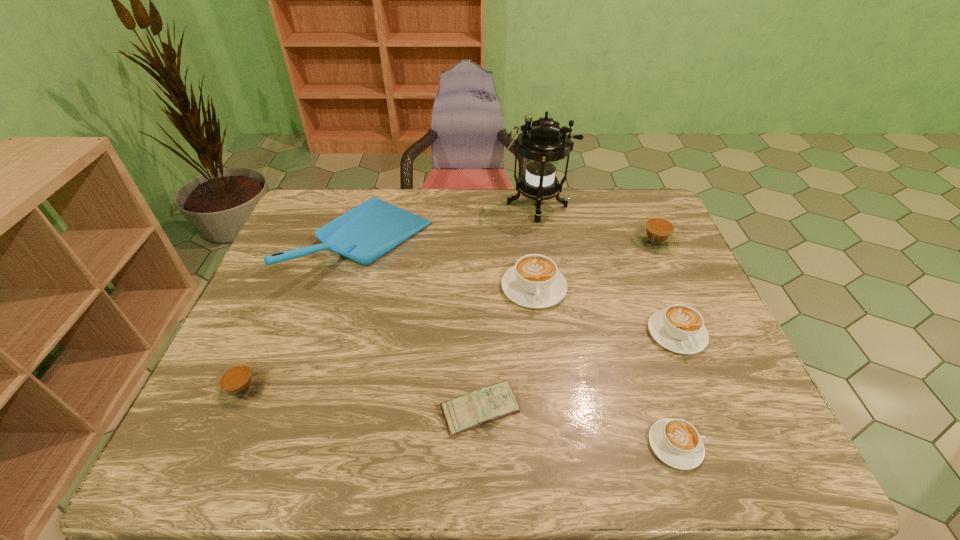
The width and height of the screenshot is (960, 540). Identify the location of object that is at the near right corner. (676, 442).

Where is `vacant space at the far edge of the desktop`? The image size is (960, 540). vacant space at the far edge of the desktop is located at coordinates (500, 217).

This screenshot has height=540, width=960. I want to click on vacant region at the left edge, so click(239, 329).

This screenshot has width=960, height=540. I want to click on vacant region at the right edge of the desktop, so click(x=660, y=303).

Image resolution: width=960 pixels, height=540 pixels. In order to click on free point at the far right corner in this screenshot , I will do `click(657, 200)`.

Identify the location of vacant area that lies between the farthest cappuccino and the second biggest white cappuccino. (665, 288).

Locate an element on the screen. vacant space that is in between the right brown cappuccino and the second smallest white cappuccino is located at coordinates (665, 288).

Locate an element on the screen. This screenshot has width=960, height=540. vacant space in between the lantern and the shortest cappuccino is located at coordinates (606, 326).

Where is `empty space that is in between the second tallest object and the nearest white cappuccino`? Image resolution: width=960 pixels, height=540 pixels. empty space that is in between the second tallest object and the nearest white cappuccino is located at coordinates (521, 345).

Where is `free space that is in between the lantern and the pink diary`? The height and width of the screenshot is (540, 960). free space that is in between the lantern and the pink diary is located at coordinates (509, 309).